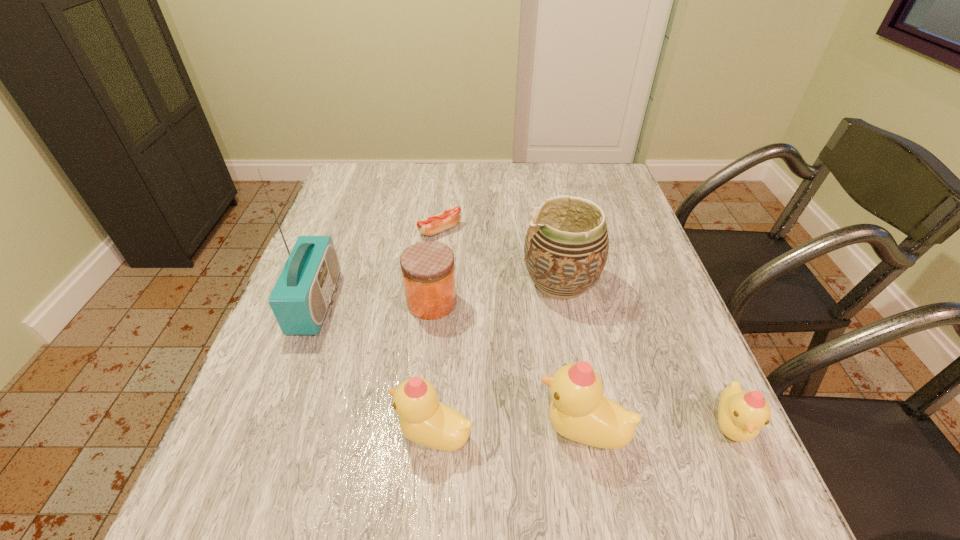
Identify which duckling is the third nearest to the tallest object. Please provide its 2D coordinates. Your answer should be formatted as a tuple, i.e. [(x, y)], where the tuple contains the x and y coordinates of a point satisfying the conditions above.

[(741, 414)]

I want to click on the closest duckling to the radio receiver, so [424, 420].

Where is `vacant region that satisfies the following two spatial constraints: 1. on the front-facing side of the rightmost object; 2. on the front-facing side of the second shortest duckling`? Image resolution: width=960 pixels, height=540 pixels. vacant region that satisfies the following two spatial constraints: 1. on the front-facing side of the rightmost object; 2. on the front-facing side of the second shortest duckling is located at coordinates (733, 434).